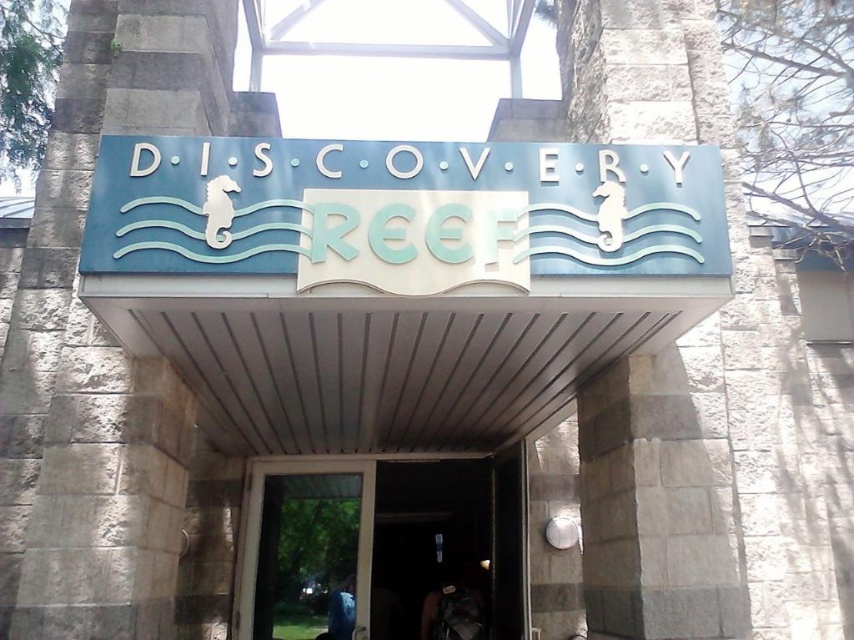
You are standing at the entrance of Discovery Reef and want to touch the point at coordinates point (653,230). If your arm can reach up to 2 meters, can you reach that point?

The point (653,230) is 2.64 meters from viewer. Since your arm can only reach up to 2 meters, you cannot reach that point.

Consider the image. You are standing at the entrance of Discovery Reef and want to locate the blue painted metal sign at center. Where should you look?

The blue painted metal sign at center is located at the center of the entrance, at coordinates approximately 0.331 on the x axis and 0.473 on the y axis.